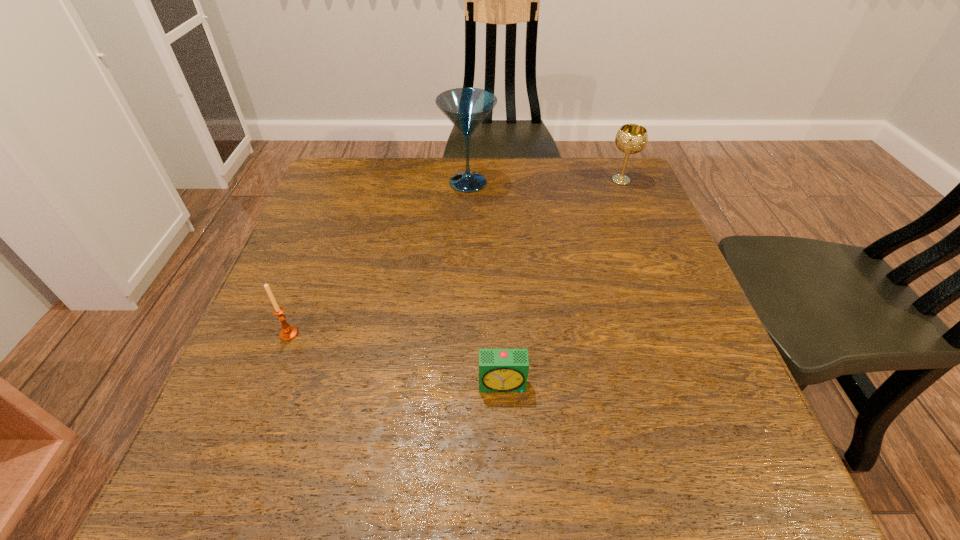
Identify the location of free area in between the tallest object and the rightmost object. Image resolution: width=960 pixels, height=540 pixels. (544, 181).

Where is `free space between the martini and the rightmost object`? The image size is (960, 540). free space between the martini and the rightmost object is located at coordinates (544, 181).

What are the coordinates of `object identified as the second closest to the nearest object` in the screenshot? It's located at (466, 108).

Select which object is the second closest to the second nearest object. Please provide its 2D coordinates. Your answer should be formatted as a tuple, i.e. [(x, y)], where the tuple contains the x and y coordinates of a point satisfying the conditions above.

[(466, 108)]

This screenshot has width=960, height=540. What are the coordinates of `free space that satisfies the following two spatial constraints: 1. on the back side of the rightmost object; 2. on the left side of the third farthest object` in the screenshot? It's located at (348, 180).

Image resolution: width=960 pixels, height=540 pixels. I want to click on vacant region that satisfies the following two spatial constraints: 1. on the back side of the second nearest object; 2. on the left side of the martini, so click(x=347, y=183).

Locate an element on the screen. The height and width of the screenshot is (540, 960). free space that satisfies the following two spatial constraints: 1. on the back side of the chalice; 2. on the left side of the martini is located at coordinates (468, 180).